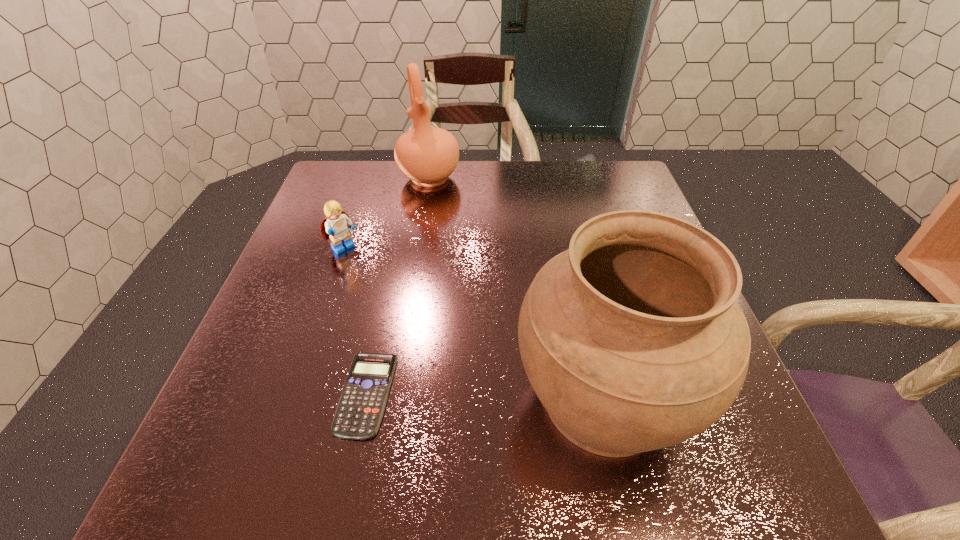
I want to click on vacant space at the left edge of the desktop, so click(244, 359).

You are a GUI agent. You are given a task and a screenshot of the screen. Output one action in this format:
    pyautogui.click(x=<x>, y=<y>)
    Task: Click on the free space at the far left corner
    The height and width of the screenshot is (540, 960).
    Given the screenshot: What is the action you would take?
    pyautogui.click(x=367, y=180)

In the image, there is a desktop. Identify the location of vacant space at the far right corner. (600, 184).

Locate an element on the screen. The image size is (960, 540). free space between the shortest object and the leftmost object is located at coordinates (355, 322).

You are a GUI agent. You are given a task and a screenshot of the screen. Output one action in this format:
    pyautogui.click(x=<x>, y=<y>)
    Task: Click on the vacant region between the calculator and the rightmost object
    The width and height of the screenshot is (960, 540).
    Given the screenshot: What is the action you would take?
    pyautogui.click(x=485, y=396)

Locate an element on the screen. This screenshot has height=540, width=960. unoccupied area between the shortest object and the second shortest object is located at coordinates (355, 322).

Find the location of a particular element. vacant space in between the farthest object and the urn is located at coordinates (516, 288).

Identify the location of free space between the pottery and the calculator. (397, 286).

Where is `free space between the shortest object and the farthest object`? The image size is (960, 540). free space between the shortest object and the farthest object is located at coordinates (397, 286).

Locate an element on the screen. empty location between the third nearest object and the pottery is located at coordinates (386, 214).